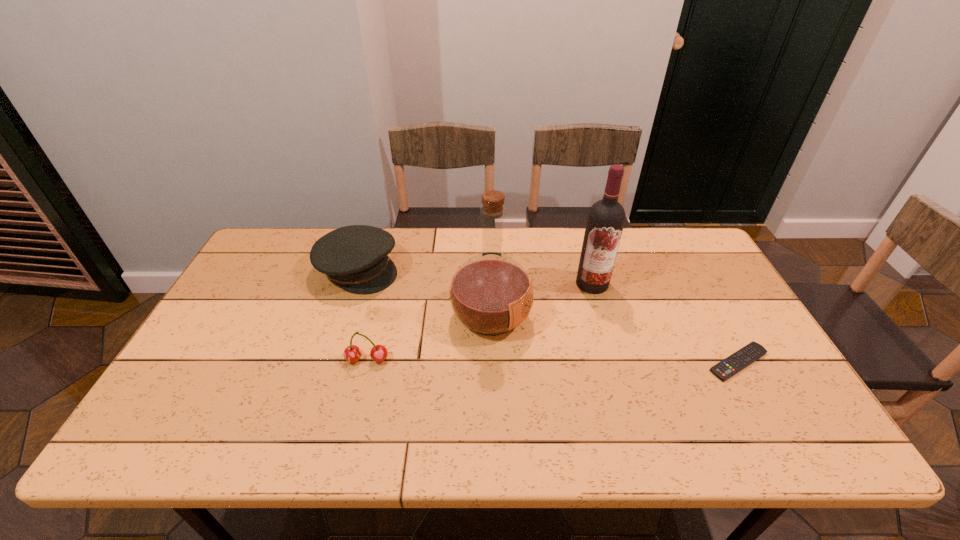
Locate an element on the screen. The image size is (960, 540). free area in between the remote control and the wine bottle is located at coordinates (665, 323).

Locate an element on the screen. The height and width of the screenshot is (540, 960). vacant region between the cherry and the shortest object is located at coordinates (553, 361).

Image resolution: width=960 pixels, height=540 pixels. What are the coordinates of `blank region between the cherry and the liquor` in the screenshot? It's located at (429, 338).

Where is `free space between the cherry and the beret`? The width and height of the screenshot is (960, 540). free space between the cherry and the beret is located at coordinates (363, 315).

This screenshot has height=540, width=960. What are the coordinates of `empty space that is in between the liquor and the beret` in the screenshot? It's located at (424, 293).

Image resolution: width=960 pixels, height=540 pixels. I want to click on object that is the fourth nearest to the beret, so click(725, 369).

Identify the location of object that stands as the fourth closest to the beret. The height and width of the screenshot is (540, 960). (725, 369).

The image size is (960, 540). What are the coordinates of `free space that satisfies the following two spatial constraints: 1. with stems pointing upwards on the cherry; 2. on the left side of the rightmost object` in the screenshot? It's located at (367, 362).

Locate an element on the screen. free region that satisfies the following two spatial constraints: 1. on the front side of the remote control; 2. on the left side of the beret is located at coordinates (328, 362).